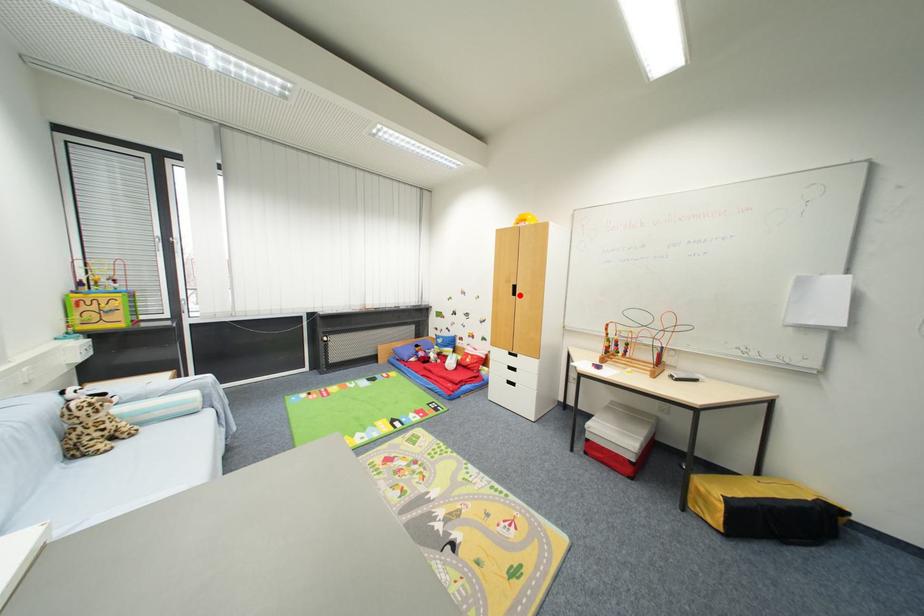
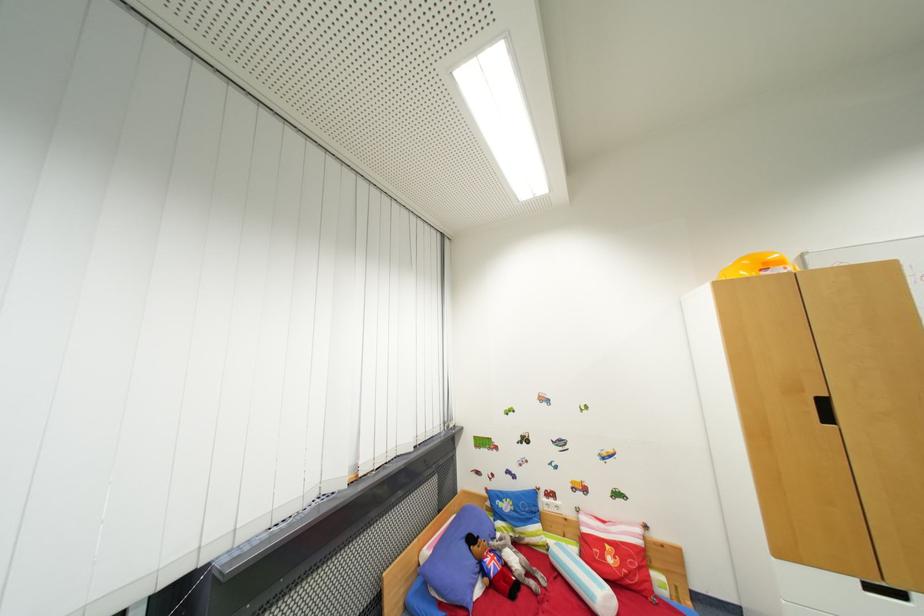
Question: I am providing you with two images of the same scene from different viewpoints. A red point is marked on the first image. Is the red point's position out of view in image 2?

Choices:
 (A) Yes
 (B) No

Answer: (B)